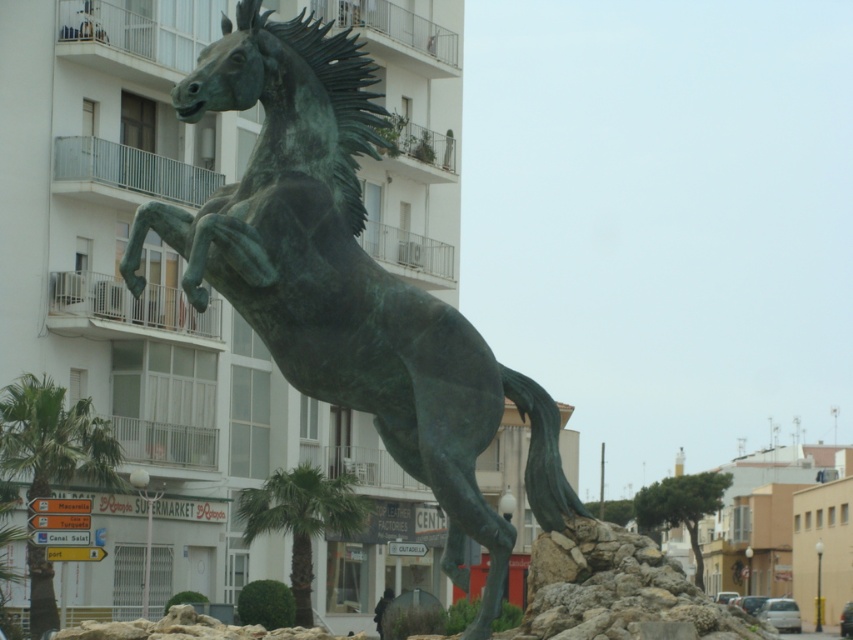
Can you confirm if green patina bronze horse at center is thinner than green leafy palm tree at center?

No, green patina bronze horse at center is not thinner than green leafy palm tree at center.

Is green patina bronze horse at center shorter than green leafy palm tree at center?

In fact, green patina bronze horse at center may be taller than green leafy palm tree at center.

At what (x,y) coordinates should I click in order to perform the action: click on green patina bronze horse at center. Please return your answer as a coordinate pair (x, y). Looking at the image, I should click on (347, 282).

Locate an element on the screen. The width and height of the screenshot is (853, 640). green patina bronze horse at center is located at coordinates (347, 282).

Looking at this image, does green patina bronze horse at center come in front of green leafy palm tree at lower left?

That is True.

Between point (407, 285) and point (39, 442), which one is positioned in front?

Point (407, 285) is more forward.

Between point (239, 214) and point (97, 467), which one is positioned in front?

Point (239, 214) is in front.

Find the location of a particular element. Image resolution: width=853 pixels, height=640 pixels. green patina bronze horse at center is located at coordinates (347, 282).

The height and width of the screenshot is (640, 853). I want to click on green leafy palm tree at lower left, so 53,436.

Is green leafy palm tree at lower left below green leafy palm tree at center?

Incorrect, green leafy palm tree at lower left is not positioned below green leafy palm tree at center.

Between point (26, 464) and point (364, 515), which one is positioned behind?

Point (364, 515)

Locate an element on the screen. green leafy palm tree at lower left is located at coordinates (53, 436).